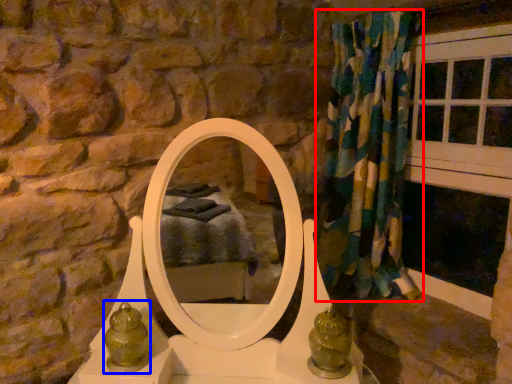
Question: Which of the following is the closest to the observer, curtain (highlighted by a red box) or antique (highlighted by a blue box)?

Choices:
 (A) curtain
 (B) antique

Answer: (B)